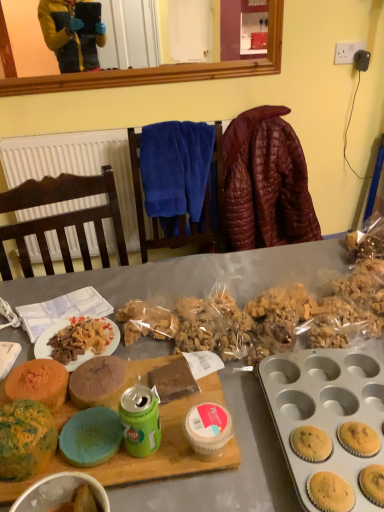
Question: Considering the positions of green metallic can at center and matte ceramic bowl at center in the image, is green metallic can at center wider or thinner than matte ceramic bowl at center?

Choices:
 (A) thin
 (B) wide

Answer: (A)

Question: In terms of height, does green metallic can at center look taller or shorter compared to matte ceramic bowl at center?

Choices:
 (A) tall
 (B) short

Answer: (B)

Question: Considering the real-world distances, which object is farthest from the white textured radiator at upper left?

Choices:
 (A) leather jacket at upper right
 (B) matte wooden desk at center
 (C) white matte plate at center
 (D) speckled green cake at center left, arranged as the second snack when viewed from the back
 (E) multicolored sponge cake at center left, the 1th snack when ordered from back to front

Answer: (D)

Question: Considering the real-world distances, which object is farthest from the white textured radiator at upper left?

Choices:
 (A) leather jacket at upper right
 (B) white matte plate at center
 (C) speckled green cake at center left, which ranks as the first snack in front-to-back order
 (D) green metallic can at center
 (E) matte wooden desk at center

Answer: (D)